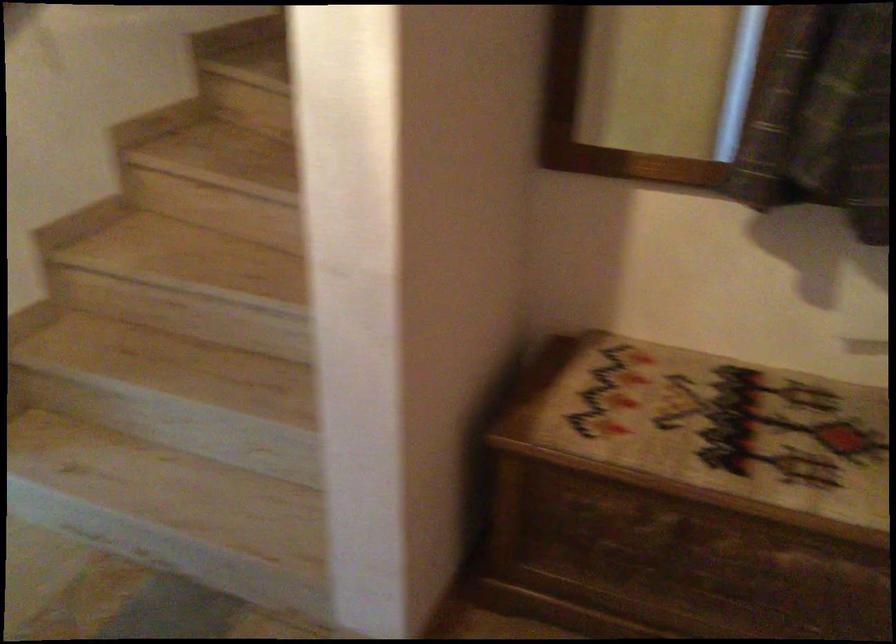
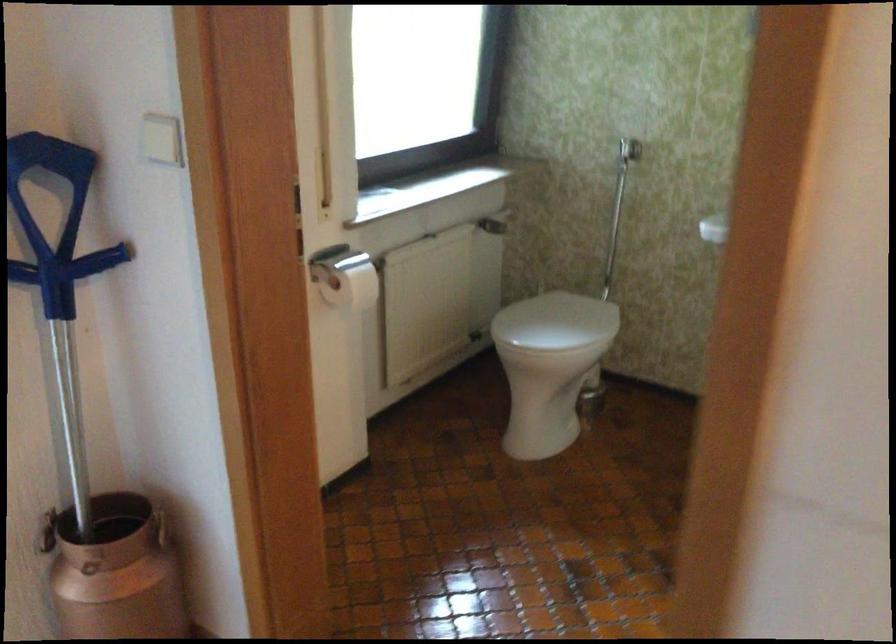
The images are taken continuously from a first-person perspective. In which direction are you moving?

The cameraman moved toward left, forward.